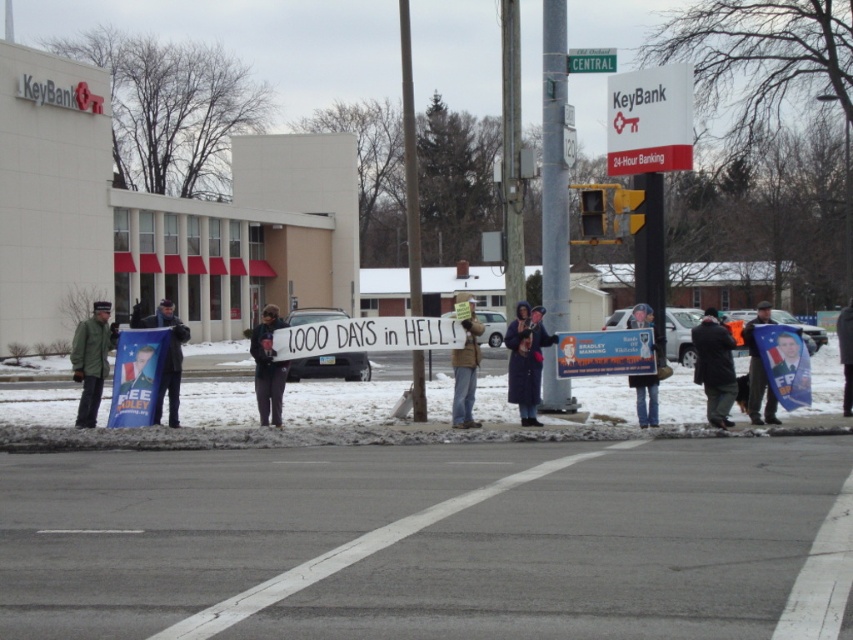
Can you confirm if dark gray fabric sign at center is wider than blue fabric flag at center?

In fact, dark gray fabric sign at center might be narrower than blue fabric flag at center.

Who is shorter, dark gray fabric sign at center or blue fabric flag at center?

dark gray fabric sign at center

Locate an element on the screen. Image resolution: width=853 pixels, height=640 pixels. dark gray fabric sign at center is located at coordinates (267, 368).

Locate an element on the screen. This screenshot has height=640, width=853. dark gray fabric sign at center is located at coordinates (267, 368).

Is metallic gray pole at center smaller than dark gray fabric sign at center?

Incorrect, metallic gray pole at center is not smaller in size than dark gray fabric sign at center.

Describe the element at coordinates (554, 166) in the screenshot. I see `metallic gray pole at center` at that location.

What do you see at coordinates (554, 166) in the screenshot? The image size is (853, 640). I see `metallic gray pole at center` at bounding box center [554, 166].

Locate an element on the screen. metallic gray pole at center is located at coordinates (554, 166).

Who is higher up, white plastic sign at upper right or dark gray fabric jacket at lower right?

Positioned higher is white plastic sign at upper right.

In the scene shown: Is white plastic sign at upper right further to the viewer compared to dark gray fabric jacket at lower right?

Yes, it is behind dark gray fabric jacket at lower right.

Between point (664, 104) and point (711, 400), which one is positioned behind?

The point (664, 104) is more distant.

At what (x,y) coordinates should I click in order to perform the action: click on white plastic sign at upper right. Please return your answer as a coordinate pair (x, y). This screenshot has width=853, height=640. Looking at the image, I should click on (648, 120).